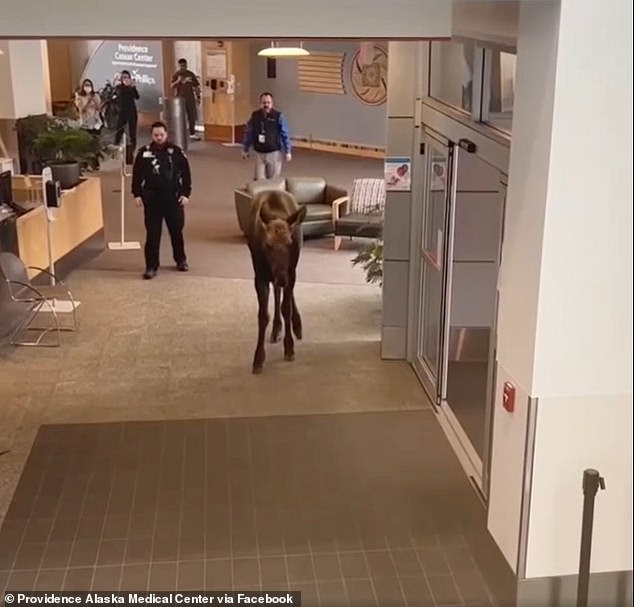
At what (x,y) coordinates should I click in order to perform the action: click on grey plant pot. Please return your answer as a coordinate pair (x, y). Looking at the image, I should click on (68, 175).